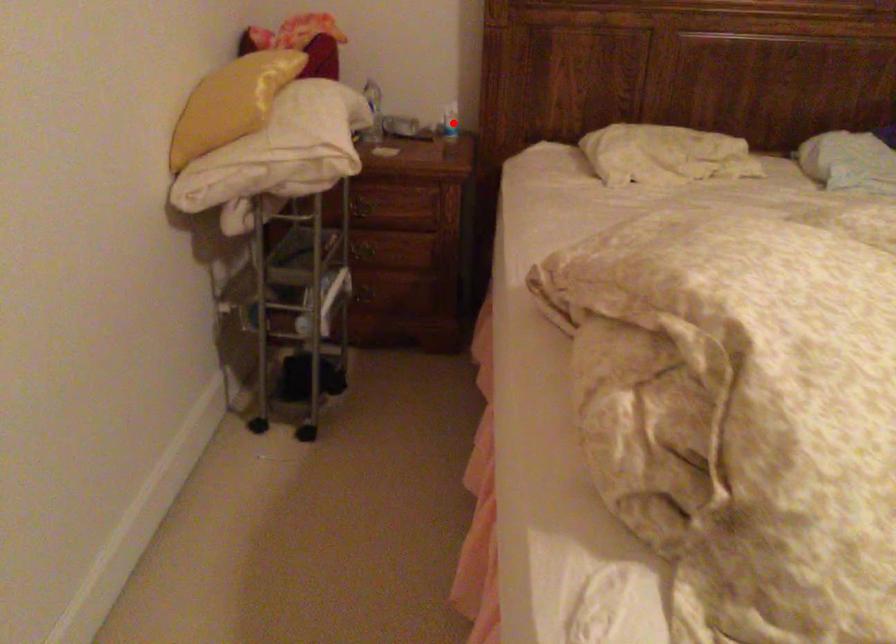
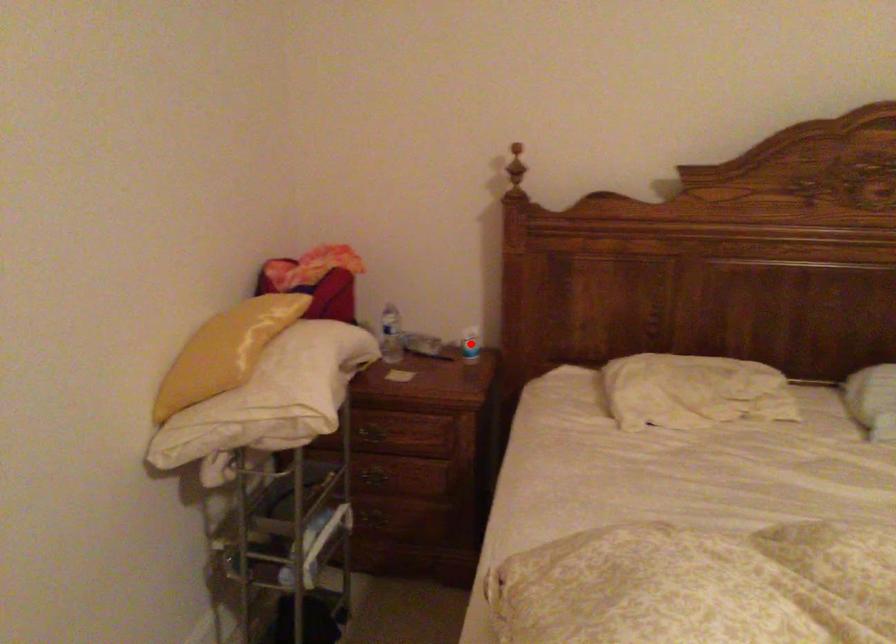
I am providing you with two images of the same scene from different viewpoints. A red point is marked on the first image and another point is marked on the second image. Do the highlighted points in image1 and image2 indicate the same real-world spot?

Yes